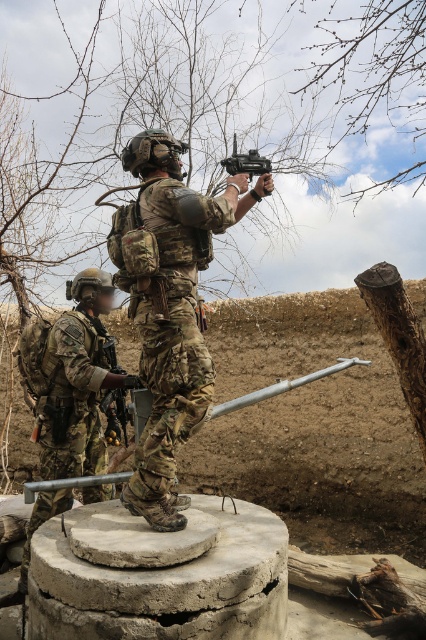
Question: Is camouflage uniform at center positioned in front of matte black toy gun at center?

Choices:
 (A) no
 (B) yes

Answer: (B)

Question: Does camouflage uniform at center have a lesser width compared to matte black toy gun at center?

Choices:
 (A) no
 (B) yes

Answer: (A)

Question: Based on their relative distances, which object is farther from the camouflage uniform at center?

Choices:
 (A) camouflage uniform at left
 (B) matte black toy gun at center

Answer: (A)

Question: Among these objects, which one is farthest from the camera?

Choices:
 (A) camouflage uniform at center
 (B) camouflage uniform at left
 (C) matte black toy gun at center

Answer: (B)

Question: Which point is closer to the camera?

Choices:
 (A) matte black toy gun at center
 (B) camouflage uniform at center

Answer: (B)

Question: Does camouflage uniform at left have a greater width compared to matte black toy gun at center?

Choices:
 (A) no
 (B) yes

Answer: (B)